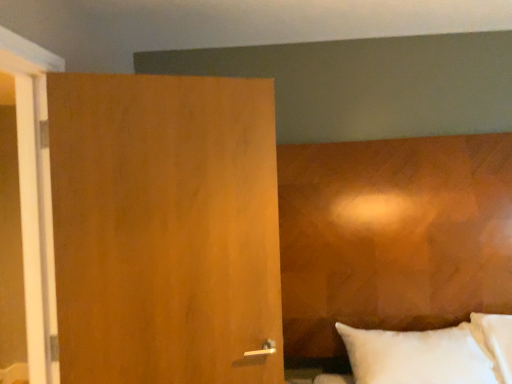
Describe the element at coordinates (165, 228) in the screenshot. I see `wooden door at left` at that location.

Find the location of a particular element. wooden door at left is located at coordinates (165, 228).

Identify the location of wooden door at left. (165, 228).